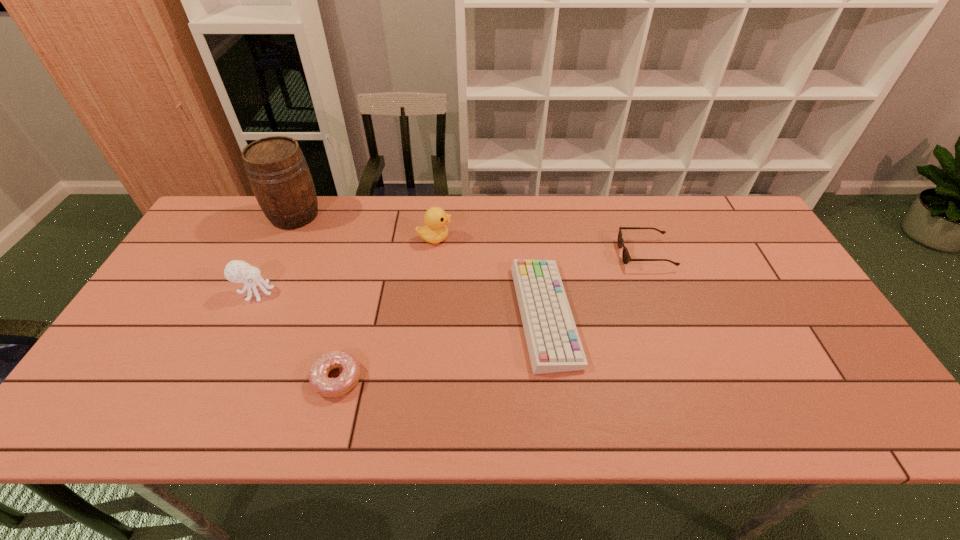
Locate an element on the screen. The height and width of the screenshot is (540, 960). the tallest object is located at coordinates (277, 171).

The image size is (960, 540). Find the location of `duck`. duck is located at coordinates (435, 231).

Find the location of a particular element. octopus is located at coordinates (237, 271).

Where is `sunglasses`? The image size is (960, 540). sunglasses is located at coordinates (626, 257).

Find the location of a particular element. The width and height of the screenshot is (960, 540). computer keyboard is located at coordinates (554, 345).

Find the location of a particular element. The width and height of the screenshot is (960, 540). the third object from left to right is located at coordinates (318, 376).

Locate an element on the screen. The image size is (960, 540). free region located 0.390m on the side of the tallest object near the bung hole is located at coordinates (239, 333).

I want to click on free space located on the face of the duck, so click(x=478, y=238).

The height and width of the screenshot is (540, 960). I want to click on vacant space located 0.330m on the front-facing side of the octopus, so click(394, 292).

This screenshot has height=540, width=960. What are the coordinates of `vacant area situated on the front lenses of the sunglasses` in the screenshot? It's located at (500, 254).